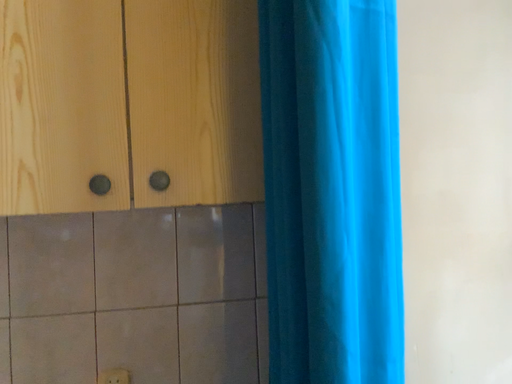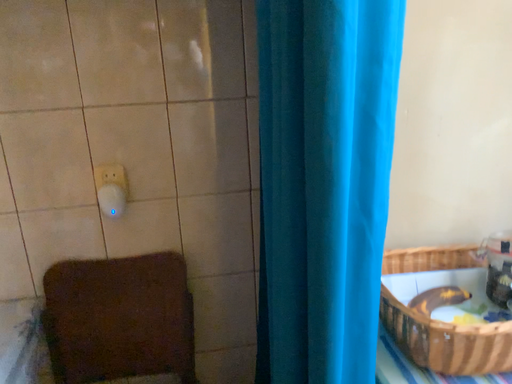
Question: Which way did the camera rotate in the video?

Choices:
 (A) rotated downward
 (B) rotated upward

Answer: (A)